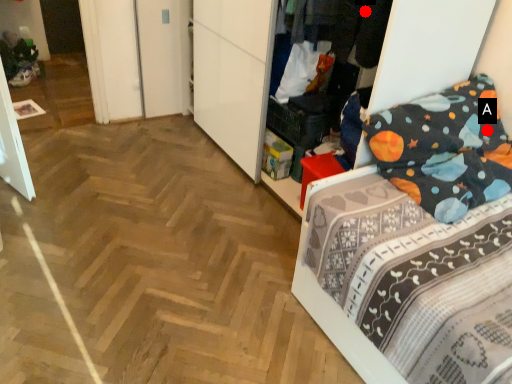
Question: Two points are circled on the image, labeled by A and B beside each circle. Which point is closer to the camera taking this photo?

Choices:
 (A) A is closer
 (B) B is closer

Answer: (B)